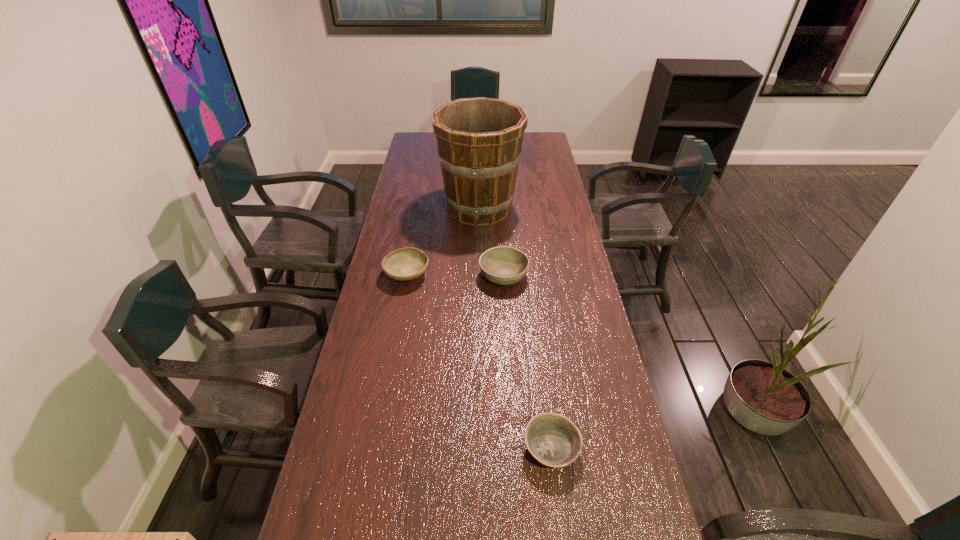
Where is `vacant point located between the bucket and the shortest object`? The image size is (960, 540). vacant point located between the bucket and the shortest object is located at coordinates (516, 328).

Find the location of a particular element. This screenshot has height=540, width=960. object that stands as the closest to the leftmost bowl is located at coordinates (479, 140).

You are a GUI agent. You are given a task and a screenshot of the screen. Output one action in this format:
    pyautogui.click(x=<x>, y=<y>)
    Task: Click on the object that is the third closest to the leftmost bowl
    
    Given the screenshot: What is the action you would take?
    pyautogui.click(x=553, y=440)

Image resolution: width=960 pixels, height=540 pixels. Find the location of `bowl that is the closest one to the nearest bowl`. bowl that is the closest one to the nearest bowl is located at coordinates (503, 265).

Select which bowl is the closest to the nearest bowl. Please provide its 2D coordinates. Your answer should be formatted as a tuple, i.e. [(x, y)], where the tuple contains the x and y coordinates of a point satisfying the conditions above.

[(503, 265)]

Where is `vacant space that satisfies the following two spatial constraints: 1. on the front side of the leftmost bowl; 2. on the left side of the shortest object`? vacant space that satisfies the following two spatial constraints: 1. on the front side of the leftmost bowl; 2. on the left side of the shortest object is located at coordinates (374, 448).

Where is `free region that satisfies the following two spatial constraints: 1. on the front side of the leftmost bowl; 2. on the left side of the nearest object`? The image size is (960, 540). free region that satisfies the following two spatial constraints: 1. on the front side of the leftmost bowl; 2. on the left side of the nearest object is located at coordinates 374,448.

Identify the location of free region that satisfies the following two spatial constraints: 1. on the back side of the leftmost bowl; 2. on the right side of the bucket. (420, 208).

Find the location of a particular element. free spot that satisfies the following two spatial constraints: 1. on the front side of the shortest object; 2. on the left side of the leftmost bowl is located at coordinates (374, 448).